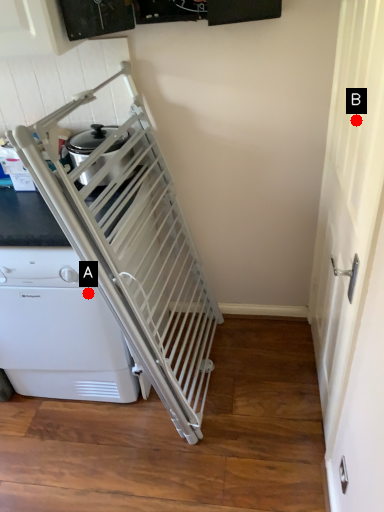
Question: Two points are circled on the image, labeled by A and B beside each circle. Which point is closer to the camera?

Choices:
 (A) A is closer
 (B) B is closer

Answer: (B)